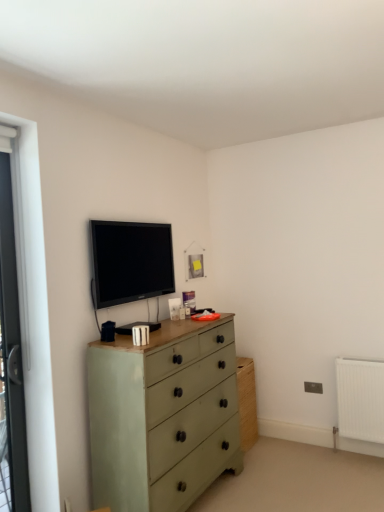
Question: Is white plastic screen door at left taller or shorter than matte black tv at upper center?

Choices:
 (A) tall
 (B) short

Answer: (A)

Question: Do you think white plastic screen door at left is within matte black tv at upper center, or outside of it?

Choices:
 (A) outside
 (B) inside

Answer: (A)

Question: Which object is the farthest from the white plastic screen door at left?

Choices:
 (A) matte green chest of drawers at center
 (B) matte black tv at upper center

Answer: (A)

Question: Based on their relative distances, which object is nearer to the matte green chest of drawers at center?

Choices:
 (A) white plastic screen door at left
 (B) matte black tv at upper center

Answer: (B)